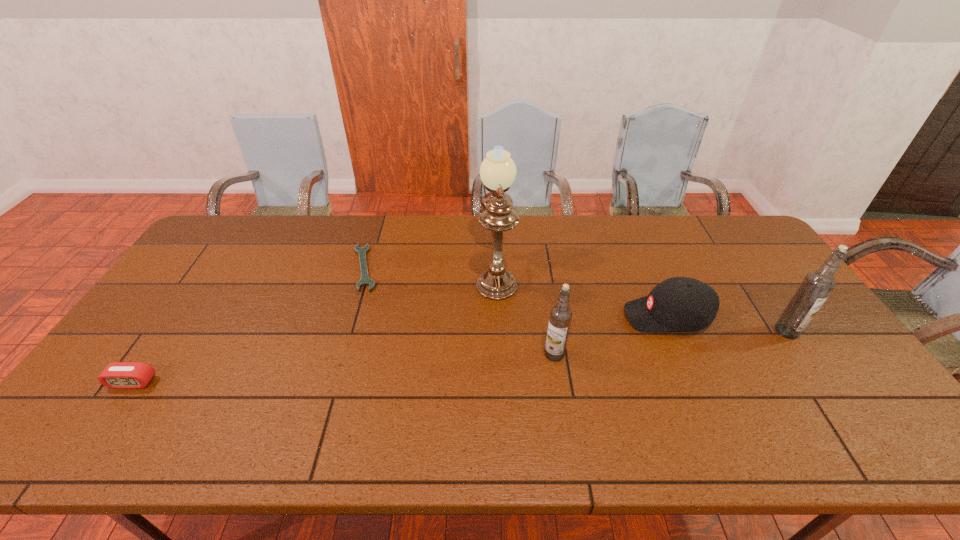
Where is `the second shortest object`? the second shortest object is located at coordinates (118, 375).

Identify the location of alarm clock. This screenshot has height=540, width=960. (118, 375).

At what (x,y) coordinates should I click in order to perform the action: click on free space located on the label of the fifth farthest object. Please return your answer as a coordinate pair (x, y). The height and width of the screenshot is (540, 960). Looking at the image, I should click on (423, 354).

Identify the location of vacant space situated on the label of the fifth farthest object. (446, 354).

At what (x,y) coordinates should I click in order to perform the action: click on vacant region located on the label of the fifth farthest object. Please return your answer as a coordinate pair (x, y). The width and height of the screenshot is (960, 540). Looking at the image, I should click on (462, 354).

Find the location of `vacant space located on the label of the taller vodka`. vacant space located on the label of the taller vodka is located at coordinates (806, 361).

The height and width of the screenshot is (540, 960). In order to click on vacant point located with a logo on the front of the baseball cap in this screenshot , I will do `click(583, 316)`.

You are a GUI agent. You are given a task and a screenshot of the screen. Output one action in this format:
    pyautogui.click(x=<x>, y=<y>)
    Task: Click on the blank space located 0.270m with a logo on the front of the baseball cap
    
    Given the screenshot: What is the action you would take?
    pyautogui.click(x=531, y=316)

What are the coordinates of `blank area located 0.390m with a logo on the front of the baseball cap` in the screenshot? It's located at (490, 316).

Locate an element on the screen. free region located on the right of the oil lamp is located at coordinates (628, 272).